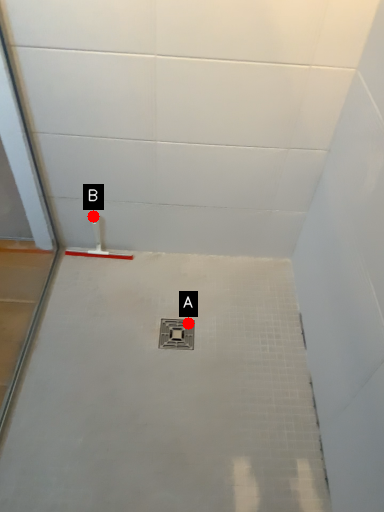
Question: Two points are circled on the image, labeled by A and B beside each circle. Among these points, which one is nearest to the camera?

Choices:
 (A) A is closer
 (B) B is closer

Answer: (A)